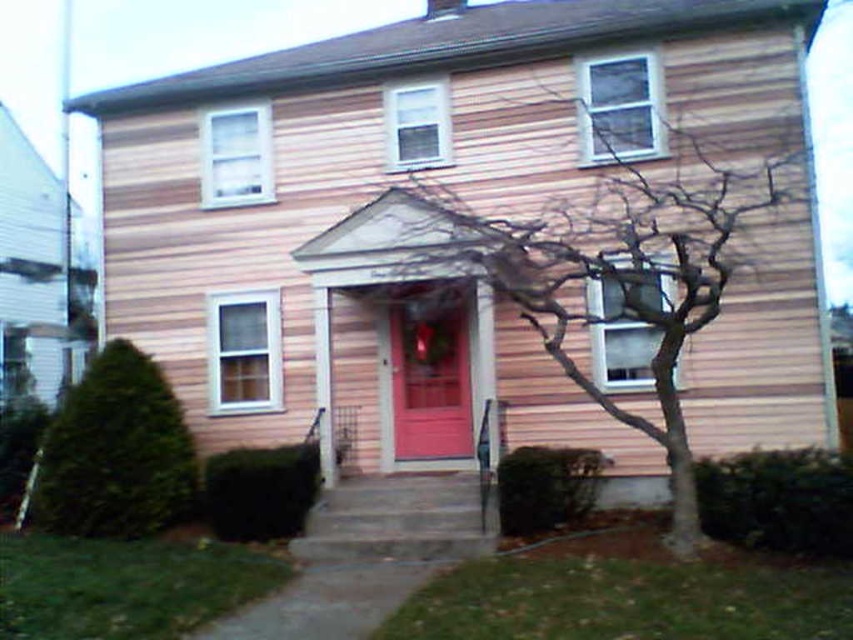
Question: Which of these objects is positioned closest to the bare branches at center?

Choices:
 (A) matte wood door at center
 (B) green leafy bush at lower left

Answer: (A)

Question: Is green leafy bush at lower left below matte wood door at center?

Choices:
 (A) no
 (B) yes

Answer: (B)

Question: Which point is closer to the camera?

Choices:
 (A) matte wood door at center
 (B) bare branches at center
 (C) green leafy bush at lower left

Answer: (C)

Question: Can you confirm if bare branches at center is smaller than matte wood door at center?

Choices:
 (A) no
 (B) yes

Answer: (A)

Question: Which object appears farthest from the camera in this image?

Choices:
 (A) bare branches at center
 (B) green leafy bush at lower left
 (C) matte wood door at center

Answer: (C)

Question: Is bare branches at center above green leafy bush at lower left?

Choices:
 (A) yes
 (B) no

Answer: (A)